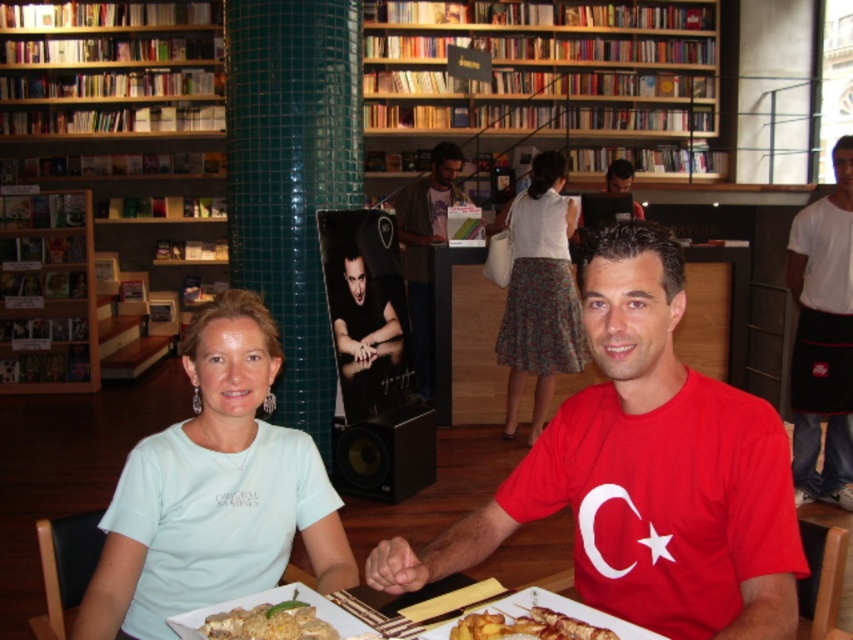
Question: Which point appears farthest from the camera in this image?

Choices:
 (A) coord(173,628)
 (B) coord(358,458)

Answer: (B)

Question: Among these objects, which one is nearest to the camera?

Choices:
 (A) white cotton shirt at right
 (B) light blue cotton shirt at center
 (C) wooden shelves at upper left

Answer: (B)

Question: In this image, where is white cotton shirt at right located relative to black matte speaker at center?

Choices:
 (A) right
 (B) left

Answer: (A)

Question: Can you confirm if wooden shelves at upper left is positioned to the left of golden crispy pastry at center?

Choices:
 (A) no
 (B) yes

Answer: (B)

Question: Which object is positioned closest to the golden crispy pastry at center?

Choices:
 (A) light blue cotton shirt at center
 (B) wooden bookshelf at upper center

Answer: (A)

Question: Considering the relative positions of wooden shelves at upper left and white matte plate at center in the image provided, where is wooden shelves at upper left located with respect to white matte plate at center?

Choices:
 (A) right
 (B) left

Answer: (B)